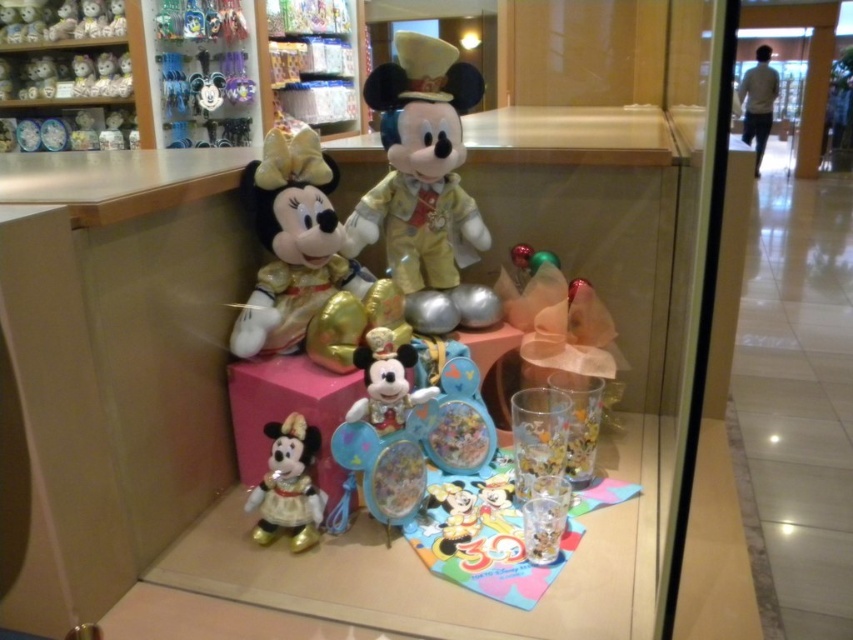
You are a store employee who needs to arrange these items for a display. Which object is taller between the gold plush minnie mouse at center and the matte black plush at upper left?

The gold plush minnie mouse at center is taller than the matte black plush at upper left according to the description.

You are a store employee who needs to place a new decorative banner between the gold plush minnie mouse at center and the matte black plush at upper left. The banner is 10 feet long. Will the banner fit between them without overlapping either plush toy?

The distance between the gold plush minnie mouse at center and the matte black plush at upper left is 11.39 feet. Since the banner is only 10 feet long, it will fit between them with some space to spare and won